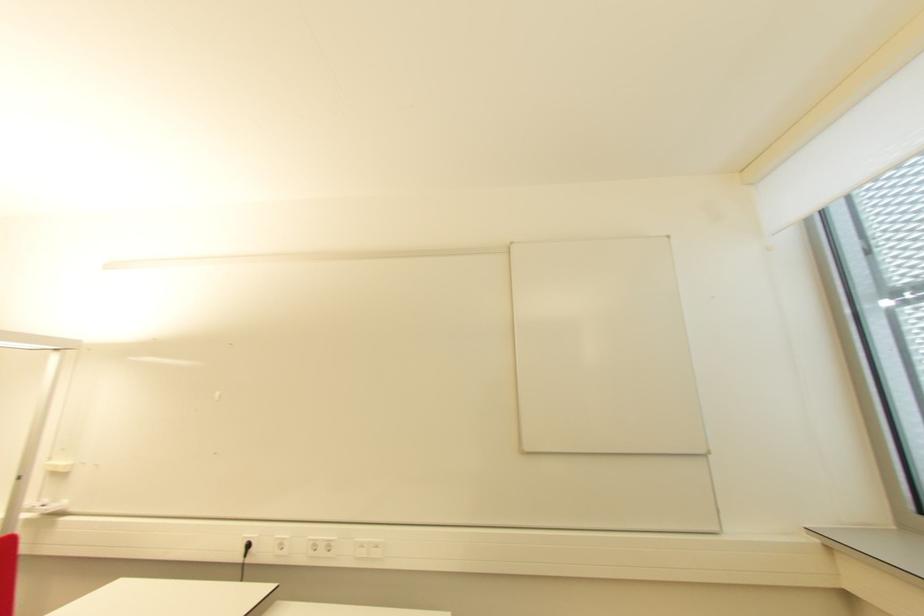
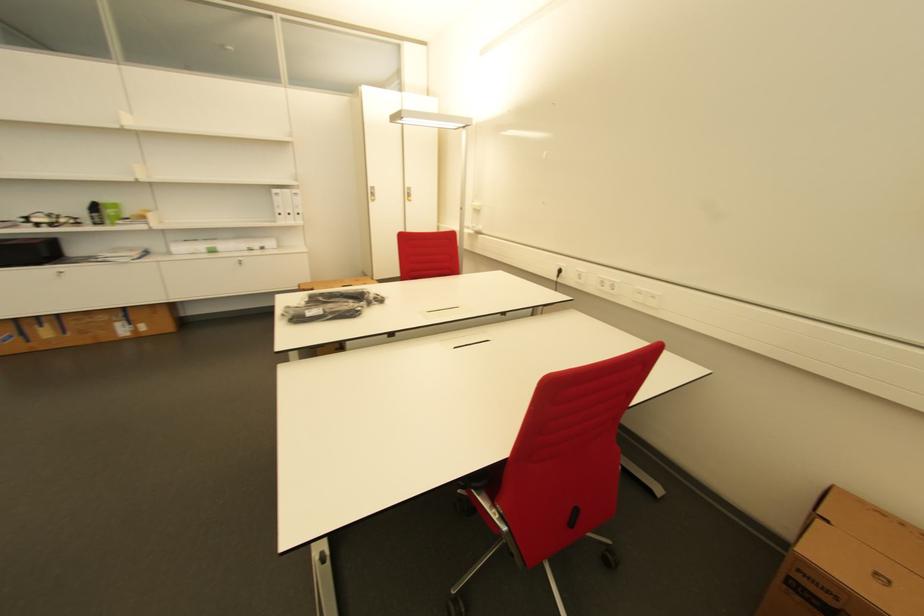
Locate, in the second image, the point that corresponds to point (382, 546) in the first image.

(659, 299)